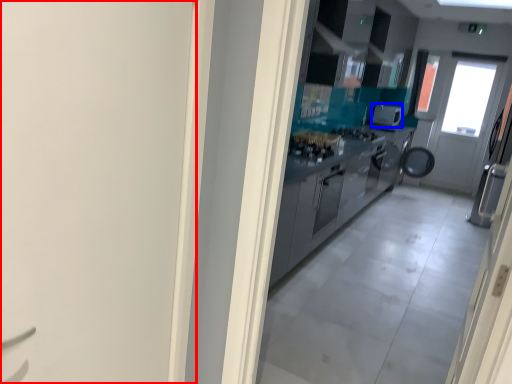
Question: Which object is closer to the camera taking this photo, door (highlighted by a red box) or appliance (highlighted by a blue box)?

Choices:
 (A) door
 (B) appliance

Answer: (A)